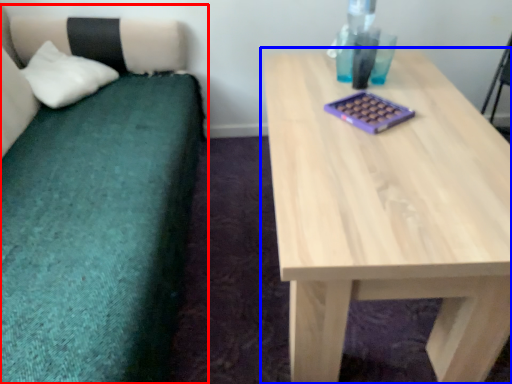
Question: Which of the following is the closest to the observer, studio couch (highlighted by a red box) or table (highlighted by a blue box)?

Choices:
 (A) studio couch
 (B) table

Answer: (A)